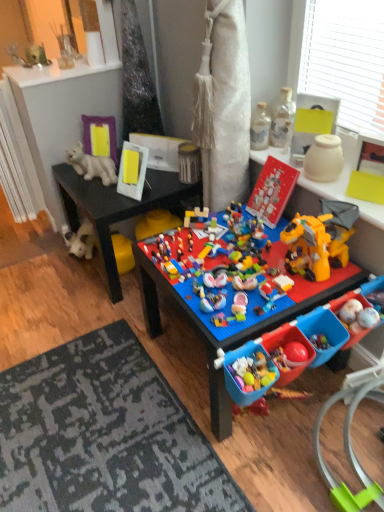
Identify the location of vacant space in front of white plush dog at lower left, the 1th toy from the left. (81, 278).